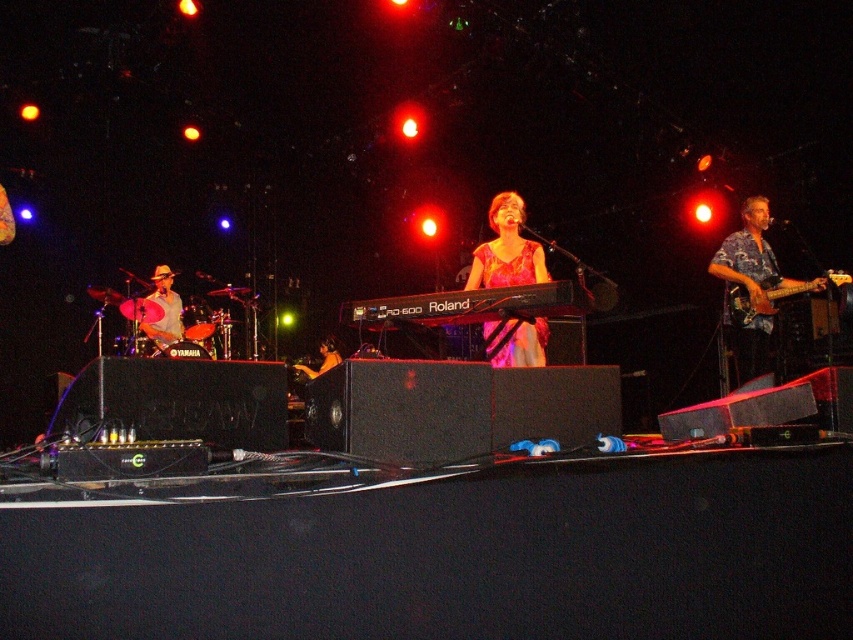
Question: Considering the relative positions of pink satin dress at center and shiny black guitar at lower left in the image provided, where is pink satin dress at center located with respect to shiny black guitar at lower left?

Choices:
 (A) above
 (B) below

Answer: (A)

Question: Which of the following is the farthest from the observer?

Choices:
 (A) wooden electric guitar at right
 (B) hawaiian print shirt at right
 (C) pink satin dress at center

Answer: (A)

Question: Can you confirm if hawaiian print shirt at right is positioned above wooden electric guitar at right?

Choices:
 (A) no
 (B) yes

Answer: (B)

Question: Is brushed metal guitar at left bigger than shiny black guitar at lower left?

Choices:
 (A) no
 (B) yes

Answer: (B)

Question: Which of these objects is positioned farthest from the pink satin dress at center?

Choices:
 (A) black matte keyboard at center
 (B) wooden electric guitar at right
 (C) shiny black guitar at lower left

Answer: (C)

Question: Which point is closer to the camera?

Choices:
 (A) (178, 298)
 (B) (746, 339)

Answer: (B)